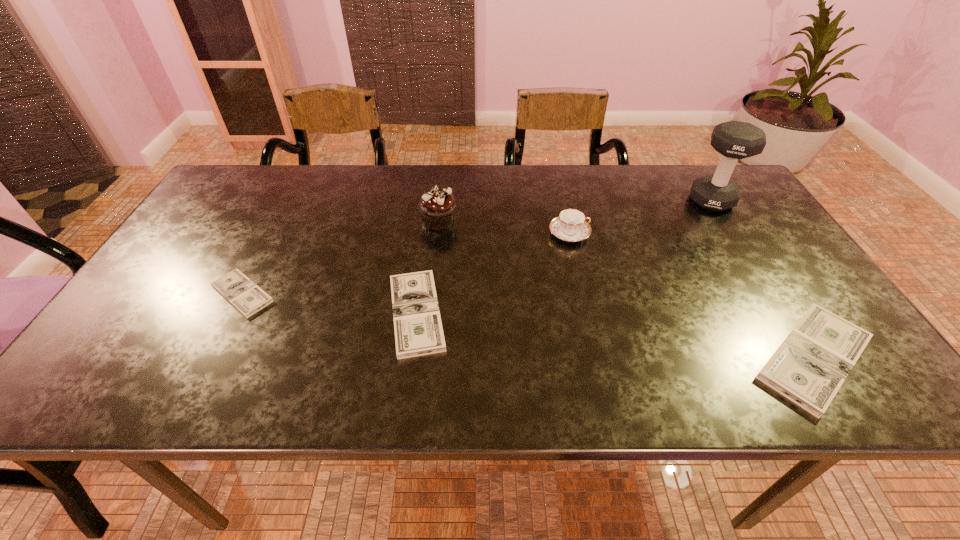
The image size is (960, 540). Identify the location of object that is at the near right corner. (809, 367).

At what (x,y) coordinates should I click in order to perform the action: click on free region at the far edge of the desktop. Please return your answer as a coordinate pair (x, y). The width and height of the screenshot is (960, 540). Looking at the image, I should click on (480, 208).

In the image, there is a desktop. What are the coordinates of `vacant space at the near edge` in the screenshot? It's located at (273, 353).

The image size is (960, 540). In order to click on vacant space at the right edge in this screenshot , I will do `click(757, 258)`.

Find the location of a particular element. The width and height of the screenshot is (960, 540). vacant region at the near left corner of the desktop is located at coordinates (135, 335).

Identify the location of vacant space that is in between the teacup and the second tallest object. This screenshot has width=960, height=540. (504, 228).

Identify the location of vacant area that lies between the rightmost dollar and the leftmost object. (528, 326).

Find the location of a particular element. This screenshot has width=960, height=540. unoccupied position between the third object from right to left and the second tallest dollar is located at coordinates (492, 273).

The width and height of the screenshot is (960, 540). I want to click on vacant area that lies between the third tallest object and the tallest object, so click(x=640, y=217).

This screenshot has height=540, width=960. I want to click on blank region between the rightmost dollar and the third object from right to left, so click(691, 296).